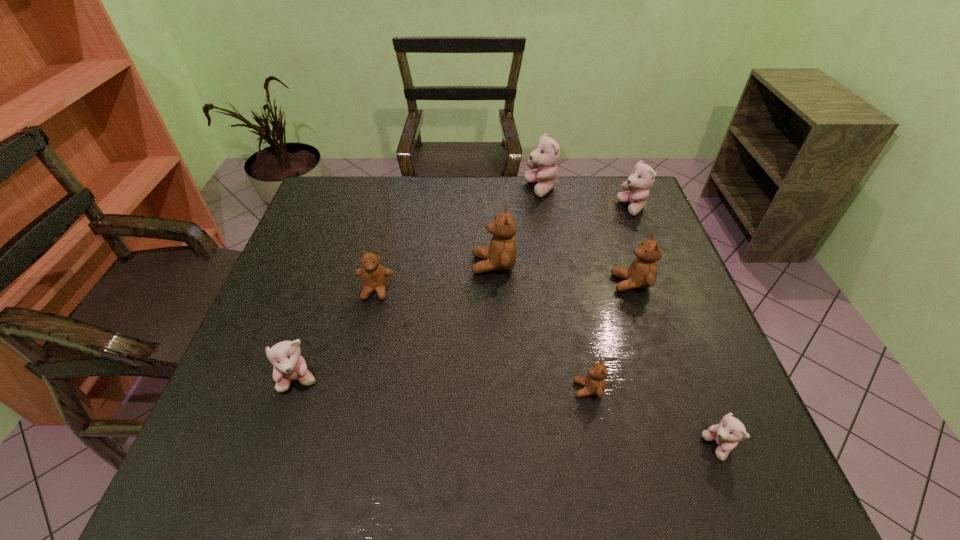
Identify the location of the biggest pink teddy bear. (545, 157).

The height and width of the screenshot is (540, 960). I want to click on the third object from left to right, so click(501, 255).

The width and height of the screenshot is (960, 540). I want to click on the second brown teddy bear from left to right, so click(x=501, y=255).

This screenshot has width=960, height=540. I want to click on the third smallest pink teddy bear, so click(642, 177).

Where is `the rightmost brown teddy bear`? the rightmost brown teddy bear is located at coordinates (642, 273).

At what (x,y) coordinates should I click in order to perform the action: click on the second object from left to right. Please return your answer as a coordinate pair (x, y). Image resolution: width=960 pixels, height=540 pixels. Looking at the image, I should click on (374, 276).

Where is `the second teddy bear from left to right`? the second teddy bear from left to right is located at coordinates (374, 276).

Where is `the third biggest pink teddy bear`? Image resolution: width=960 pixels, height=540 pixels. the third biggest pink teddy bear is located at coordinates (289, 365).

Where is `the second nearest pink teddy bear`? the second nearest pink teddy bear is located at coordinates (289, 365).

Where is `the smallest brown teddy bear`? Image resolution: width=960 pixels, height=540 pixels. the smallest brown teddy bear is located at coordinates (594, 383).